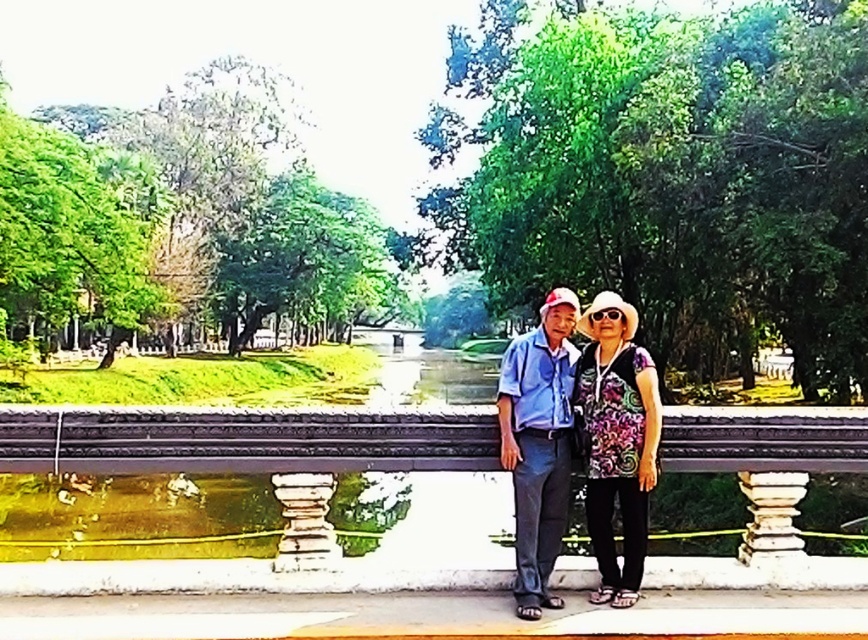
You are a photographer trying to capture a photo of the two people on the stone bridge. You want to ensure that the black textured rail at center is visible in the background. Based on their current positions, will the rail be visible behind them?

The black textured rail at center is located at point coordinates (241, 440), so it is positioned behind the two people on the stone bridge. Therefore, the rail will be visible in the background of the photo.

You are a photographer taking a picture of the scene. You notice a specific point at coordinates (241, 440). What object in the scene is located at this point?

The point at coordinates (241, 440) corresponds to the black textured rail at center.